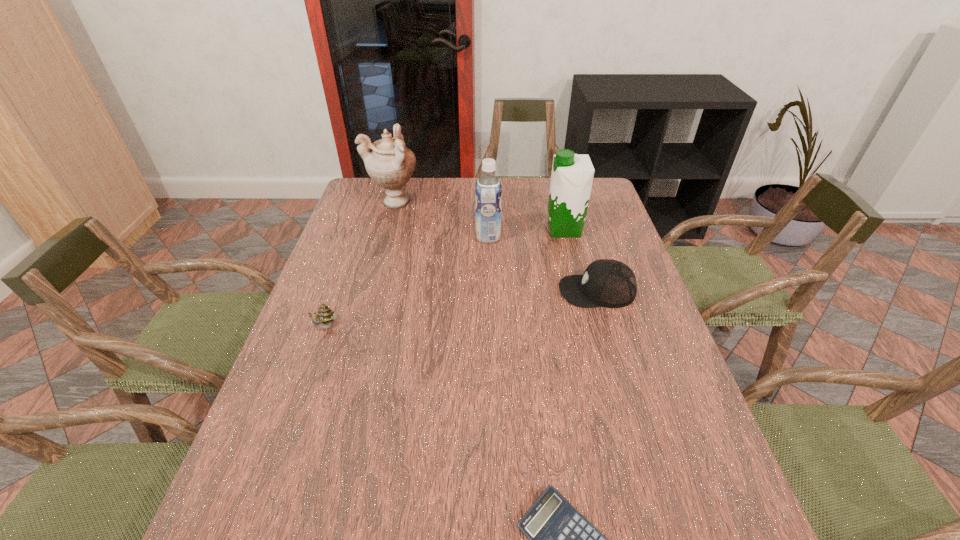
I want to click on vacant space located on the label of the left soya milk, so click(457, 237).

Where is `vacant space situated on the label of the left soya milk`? Image resolution: width=960 pixels, height=540 pixels. vacant space situated on the label of the left soya milk is located at coordinates (457, 237).

The image size is (960, 540). Find the location of `free spot located on the front-facing side of the cap`. free spot located on the front-facing side of the cap is located at coordinates (487, 291).

Find the location of a particular element. The width and height of the screenshot is (960, 540). free location located on the front-facing side of the cap is located at coordinates (x=526, y=291).

Where is `vacant space located 0.360m on the front-facing side of the cap`? The height and width of the screenshot is (540, 960). vacant space located 0.360m on the front-facing side of the cap is located at coordinates point(429,291).

You are a GUI agent. You are given a task and a screenshot of the screen. Output one action in this format:
    pyautogui.click(x=<x>, y=<y>)
    Task: Click on the vacant space located on the face of the snail
    
    Given the screenshot: What is the action you would take?
    pyautogui.click(x=296, y=414)

Where is `object at the far edge`? The image size is (960, 540). object at the far edge is located at coordinates (390, 164).

Locate an element on the screen. urn at the left edge is located at coordinates (390, 164).

Where is `snail located at the left edge`? The width and height of the screenshot is (960, 540). snail located at the left edge is located at coordinates (325, 315).

Find the location of `soya milk at the right edge`. soya milk at the right edge is located at coordinates (572, 175).